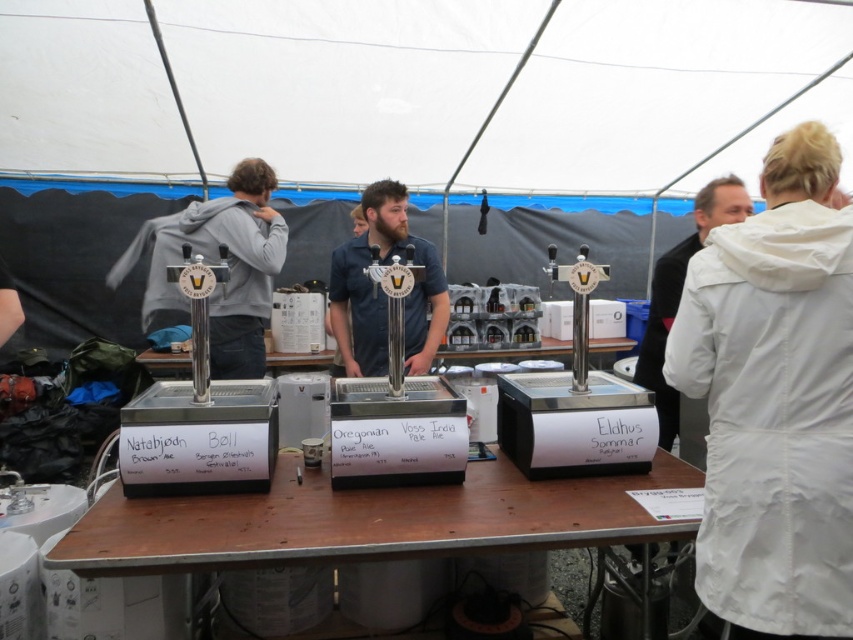
At the beer tasting event, you notice two items on the table next to the beer taps. One is a matte gray hoodie at left and the other is a white matte jacket at right. Which item takes up more space on the table?

The matte gray hoodie at left takes up more space on the table because it has a larger size compared to the white matte jacket at right.

You are a guest at the beer tasting event. You see the white matte lab coat at right. Where is it located in the image?

The white matte lab coat at right is located at point 0.652 on the x axis and 0.907 on the y axis.